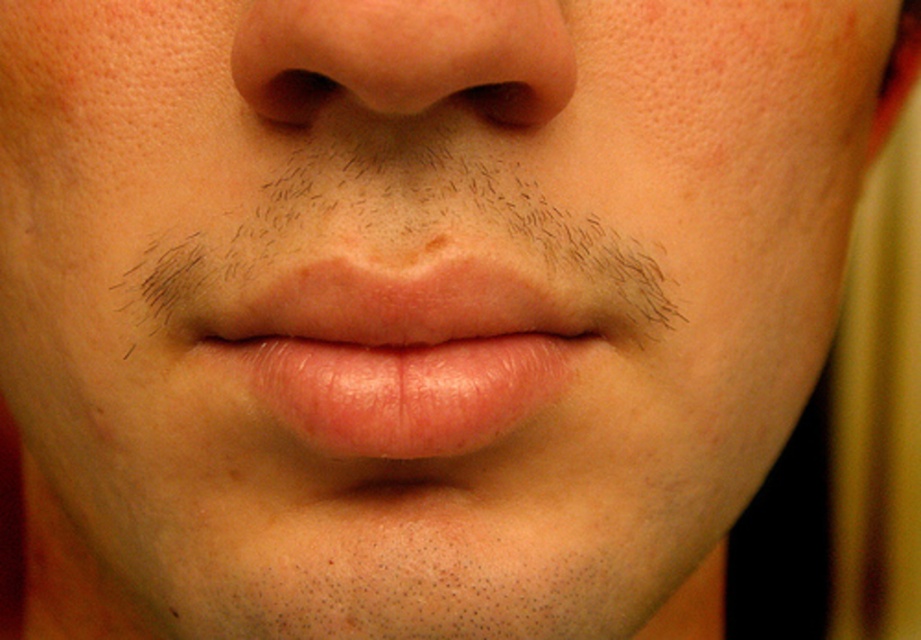
You are a makeup artist preparing to apply eyeliner. You need to ensure that the distance between the brown hair at center and the black matte eye at upper center is at least 5 centimeters to avoid smudging. Based on the image provided, is the current distance sufficient?

The distance between the brown hair at center and the black matte eye at upper center is 4.83 centimeters, which is less than the required 5 centimeters. Therefore, the current distance is not sufficient to avoid smudging.

You are a photographer adjusting the focus on a camera. You want to ensure that both the brown hair at center and the mole below the nose are in focus. The depth of field allows for sharp focus up to 10 inches. Can both objects be in focus simultaneously?

The brown hair at center and the mole below the nose are 11.72 inches apart, which exceeds the depth of field limit of 10 inches. Therefore, both cannot be in focus at the same time.